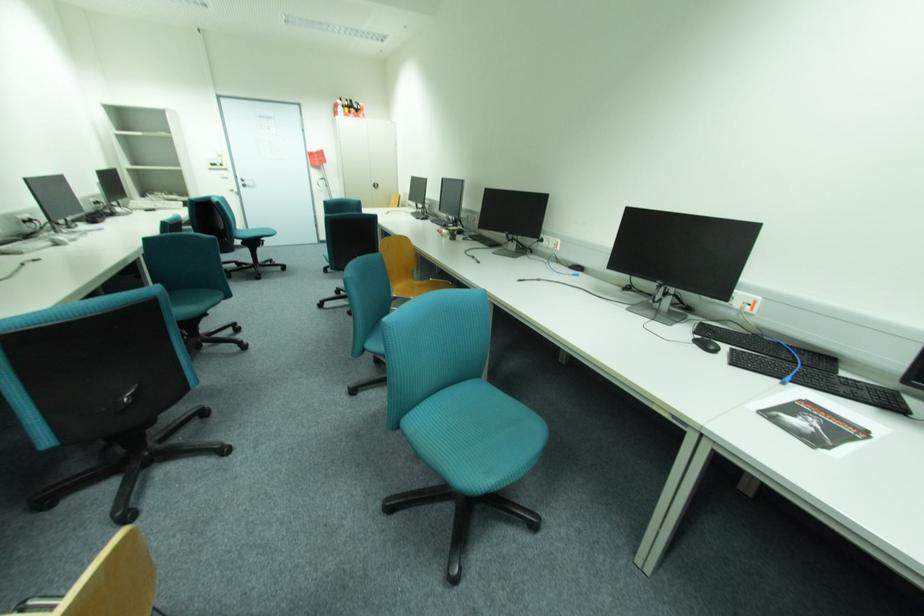
The image size is (924, 616). Describe the element at coordinates (813, 424) in the screenshot. I see `the printed paper document` at that location.